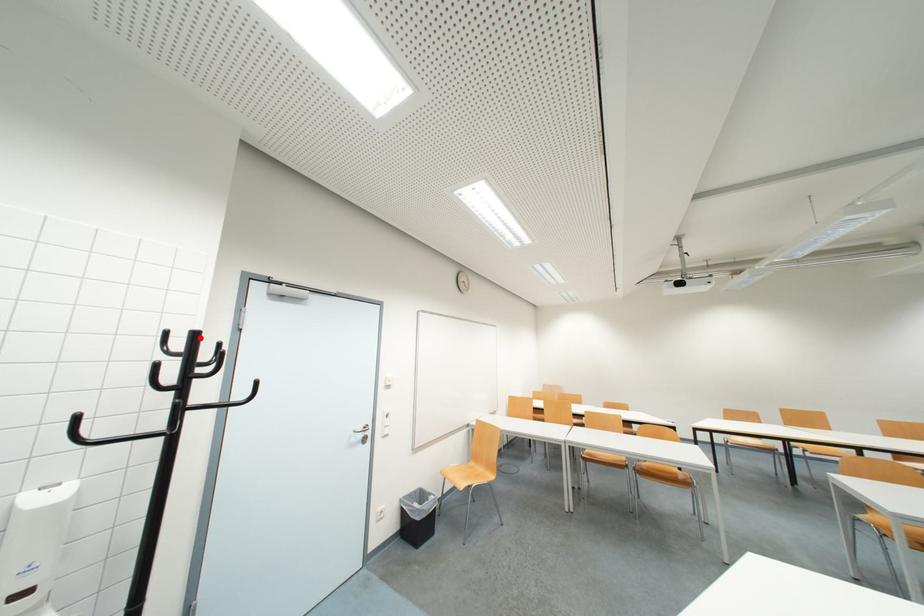
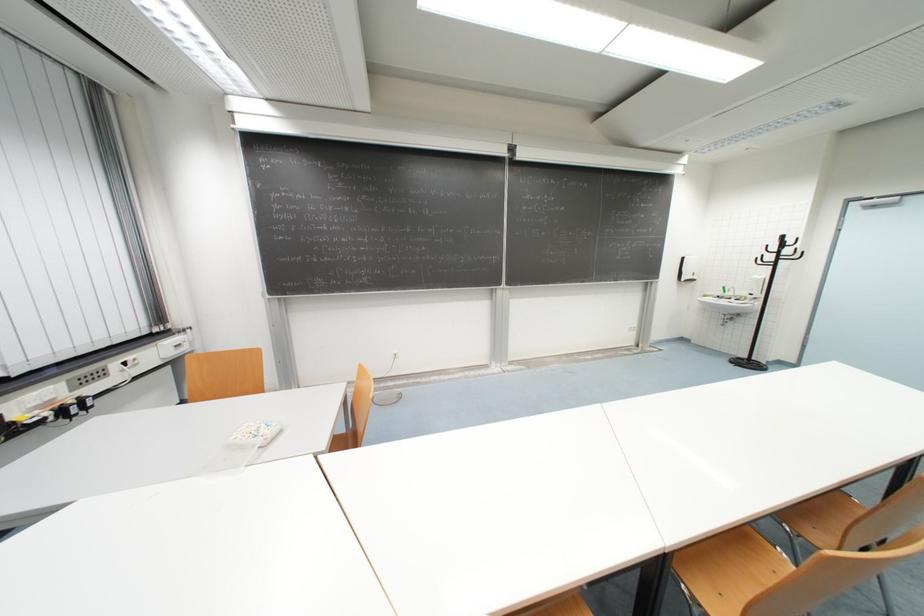
Find the pixel in the second image that matches the highlighted location in the first image.

(789, 238)